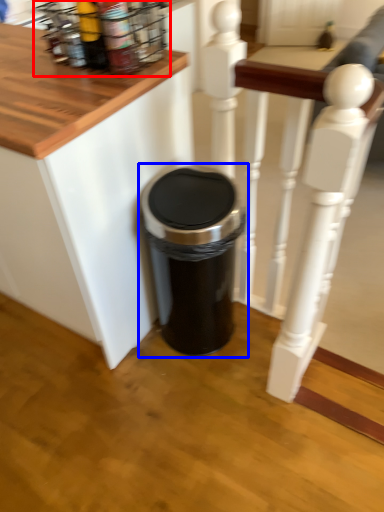
Question: Among these objects, which one is nearest to the camera, spice rack (highlighted by a red box) or waste container (highlighted by a blue box)?

Choices:
 (A) spice rack
 (B) waste container

Answer: (A)